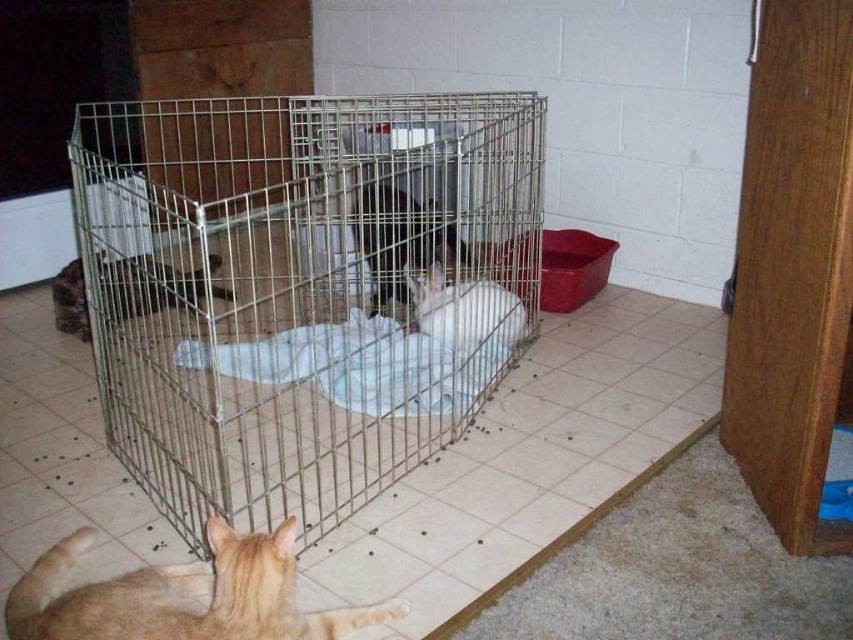
Question: Which point appears closest to the camera in this image?

Choices:
 (A) (335, 396)
 (B) (492, 324)
 (C) (386, 243)

Answer: (A)

Question: Does orange fur cat at lower left come in front of white fur rabbit at center?

Choices:
 (A) no
 (B) yes

Answer: (B)

Question: Which point is closer to the camera taking this photo?

Choices:
 (A) pyautogui.click(x=399, y=278)
 (B) pyautogui.click(x=280, y=621)

Answer: (B)

Question: Among these objects, which one is nearest to the camera?

Choices:
 (A) orange fur cat at lower left
 (B) fluffy brown cat at center
 (C) brown fur cat at center
 (D) metal wire cage at center

Answer: (A)

Question: Is brown fur cat at center above fluffy brown cat at center?

Choices:
 (A) yes
 (B) no

Answer: (A)

Question: From the image, what is the correct spatial relationship of metal wire cage at center in relation to orange fur cat at lower left?

Choices:
 (A) left
 (B) right

Answer: (B)